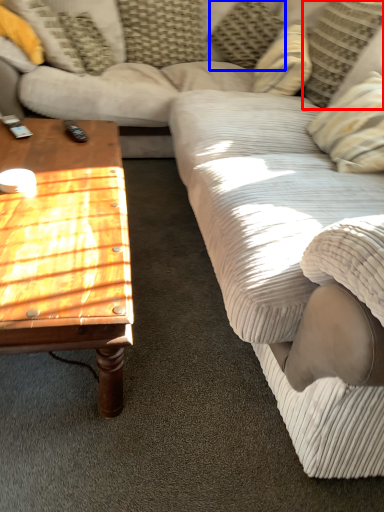
Question: Which of the following is the farthest to the observer, pillow (highlighted by a red box) or pillow (highlighted by a blue box)?

Choices:
 (A) pillow
 (B) pillow

Answer: (B)